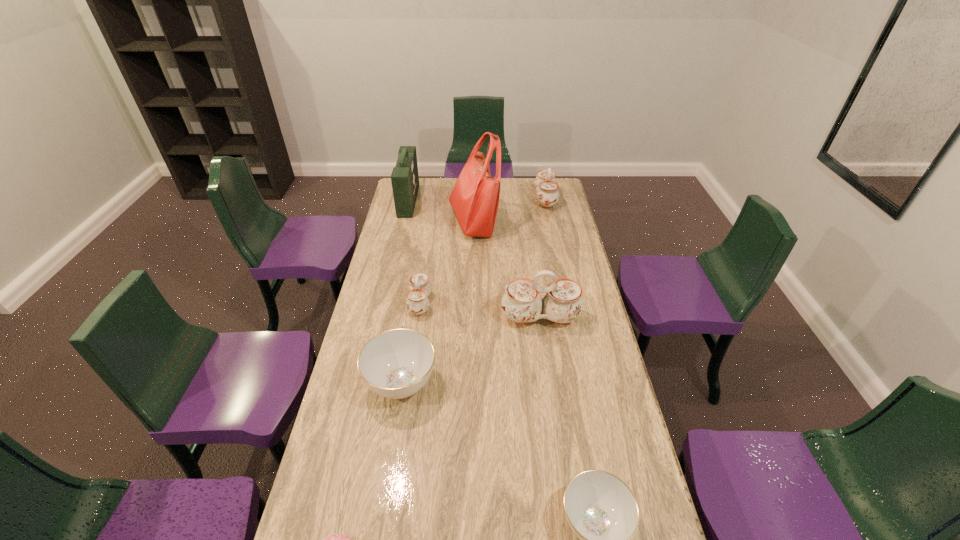
This screenshot has height=540, width=960. What are the coordinates of `the first-aid kit present at the left edge` in the screenshot? It's located at [x=405, y=180].

Where is `chinaware at the left edge`? The image size is (960, 540). chinaware at the left edge is located at coordinates (395, 364).

Find the location of a particular element. object present at the far left corner is located at coordinates (405, 180).

Identify the location of object at the far right corner. (545, 184).

The image size is (960, 540). In the image, there is a desktop. What are the coordinates of `vacant space at the far edge` in the screenshot? It's located at (501, 187).

Locate an element on the screen. The height and width of the screenshot is (540, 960). vacant space at the left edge of the desktop is located at coordinates (310, 512).

At what (x,y) coordinates should I click in order to perform the action: click on vacant area at the right edge of the desktop. Please return your answer as a coordinate pair (x, y). The image size is (960, 540). Looking at the image, I should click on (564, 222).

Locate an element on the screen. free space between the leftmost white chinaware and the farthest chinaware is located at coordinates pos(483,252).

This screenshot has height=540, width=960. In order to click on empty space between the smallest white chinaware and the tallest chinaware in this screenshot , I will do `click(480, 310)`.

You are a GUI agent. You are given a task and a screenshot of the screen. Output one action in this format:
    pyautogui.click(x=<x>, y=<y>)
    Task: Click on the vacant space that is in between the first-aid kit and the farther gray chinaware
    Image resolution: width=960 pixels, height=540 pixels.
    Given the screenshot: What is the action you would take?
    pyautogui.click(x=405, y=292)